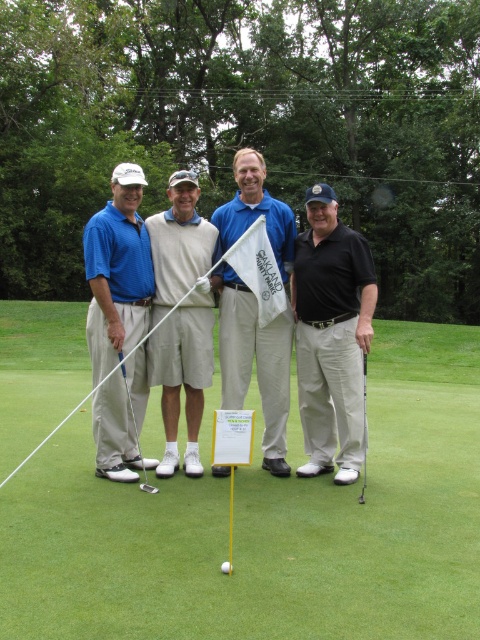
Is matte blue shirt at left shorter than white matte golf ball at center?

No, matte blue shirt at left is not shorter than white matte golf ball at center.

Does point (136, 403) come in front of point (228, 573)?

No, (136, 403) is further to viewer.

This screenshot has height=640, width=480. In order to click on matte blue shirt at left in this screenshot , I will do `click(118, 273)`.

Describe the element at coordinates (332, 337) in the screenshot. I see `black matte golf club at center` at that location.

The image size is (480, 640). What do you see at coordinates (332, 337) in the screenshot?
I see `black matte golf club at center` at bounding box center [332, 337].

Where is `black matte golf club at center`? black matte golf club at center is located at coordinates (332, 337).

Is matte blue shirt at left shorter than shiny silver putter at lower left?

Correct, matte blue shirt at left is not as tall as shiny silver putter at lower left.

Based on the photo, can you confirm if matte blue shirt at left is taller than shiny silver putter at lower left?

No, matte blue shirt at left is not taller than shiny silver putter at lower left.

Is point (105, 452) positioned after point (129, 392)?

Yes.

This screenshot has width=480, height=640. Find the location of `matte blue shirt at left`. matte blue shirt at left is located at coordinates (118, 273).